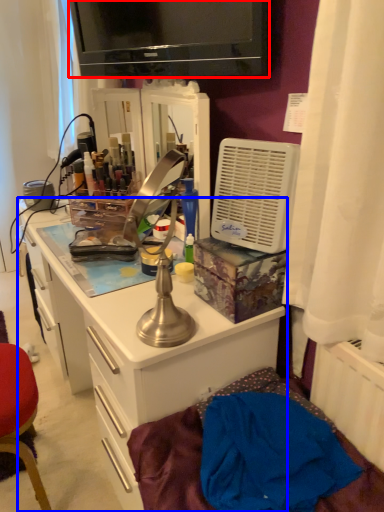
Question: Which object is further to the camera taking this photo, television (highlighted by a red box) or cabinetry (highlighted by a blue box)?

Choices:
 (A) television
 (B) cabinetry

Answer: (B)